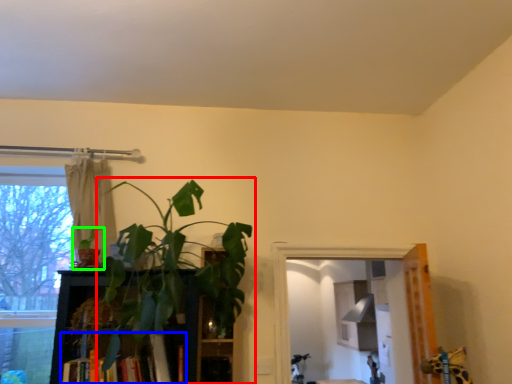
Question: Considering the real-world distances, which object is closest to houseplant (highlighted by a red box)? book (highlighted by a blue box) or houseplant (highlighted by a green box).

Choices:
 (A) book
 (B) houseplant

Answer: (A)